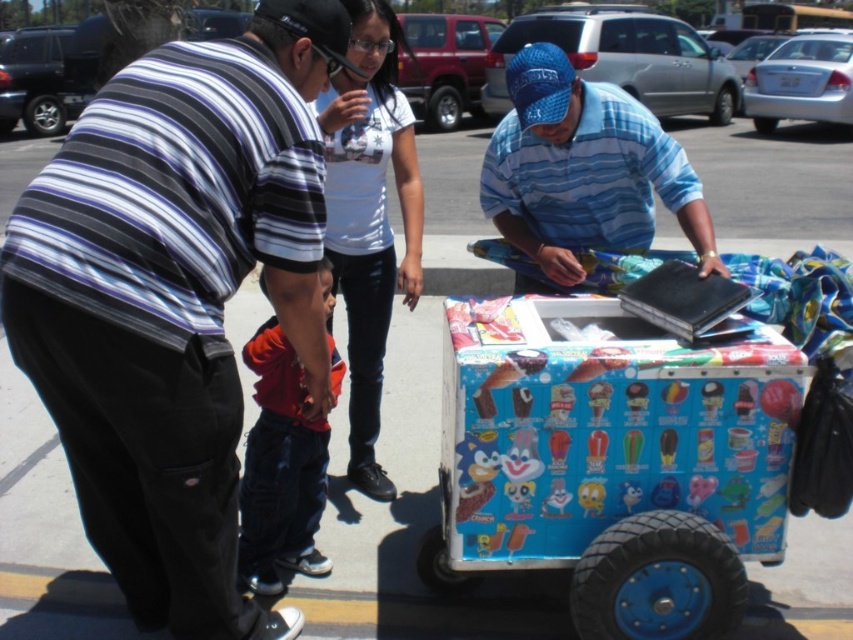
Question: Is the position of striped shirt at left more distant than that of orange fabric pants at lower center?

Choices:
 (A) no
 (B) yes

Answer: (A)

Question: Does blue plastic wagon at lower center have a greater width compared to orange fabric pants at lower center?

Choices:
 (A) yes
 (B) no

Answer: (A)

Question: Which object appears closest to the camera in this image?

Choices:
 (A) blue striped shirt at center
 (B) white matte shirt at upper center
 (C) striped shirt at left

Answer: (C)

Question: Among these objects, which one is farthest from the camera?

Choices:
 (A) blue striped shirt at center
 (B) orange fabric pants at lower center

Answer: (A)

Question: Among these points, which one is nearest to the camera?

Choices:
 (A) (405, 115)
 (B) (267, 499)
 (C) (688, 538)
 (D) (215, 358)

Answer: (D)

Question: Is white matte shirt at upper center above orange fabric pants at lower center?

Choices:
 (A) yes
 (B) no

Answer: (A)